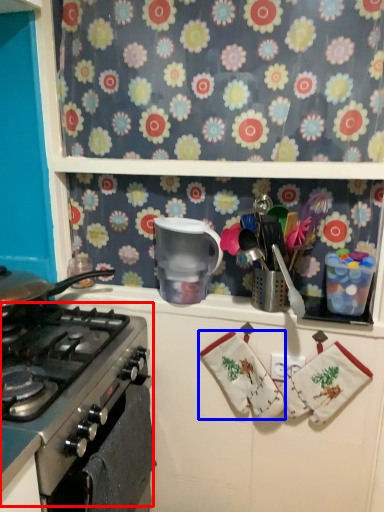
Question: Which of the following is the farthest to the observer, gas stove (highlighted by a red box) or hand towel (highlighted by a blue box)?

Choices:
 (A) gas stove
 (B) hand towel

Answer: (B)